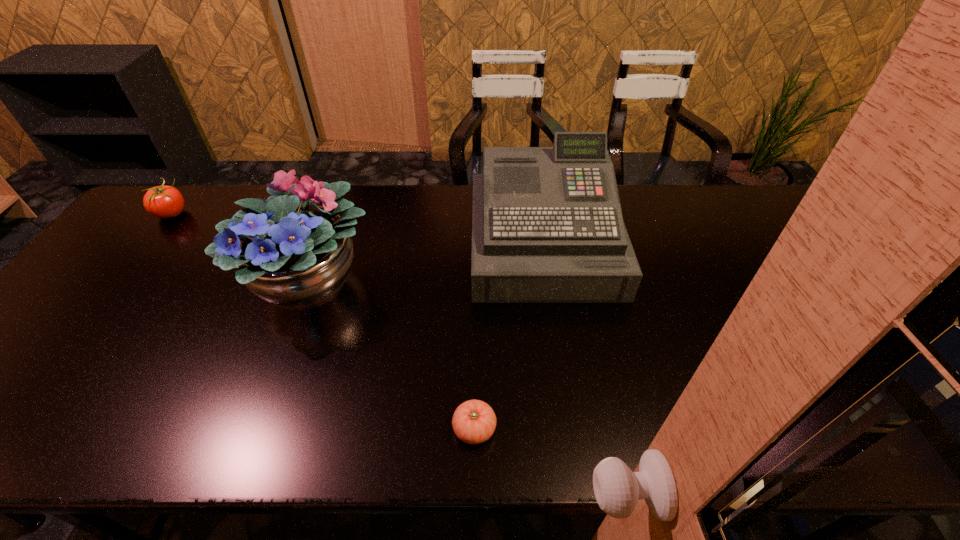
Where is `bouquet`? This screenshot has height=540, width=960. bouquet is located at coordinates (289, 251).

Identify the location of cash register. (547, 227).

I want to click on the second shortest object, so click(163, 201).

This screenshot has width=960, height=540. Find the location of `the taller tomato`. the taller tomato is located at coordinates (163, 201).

At what (x,y) coordinates should I click in order to perform the action: click on the shorter tomato. Please return your answer as a coordinate pair (x, y). The image size is (960, 540). Looking at the image, I should click on (474, 421).

Where is `the shortest object`? The width and height of the screenshot is (960, 540). the shortest object is located at coordinates (474, 421).

This screenshot has height=540, width=960. In order to click on vacant area situated on the left of the bouquet in this screenshot , I will do `click(132, 282)`.

The image size is (960, 540). I want to click on free space located 0.340m on the front-facing side of the cash register, so click(x=571, y=426).

The image size is (960, 540). In order to click on vacant space located on the right of the second shortest object in this screenshot , I will do `click(245, 214)`.

This screenshot has width=960, height=540. In order to click on free location located 0.170m on the right of the nearest object in this screenshot , I will do `click(578, 429)`.